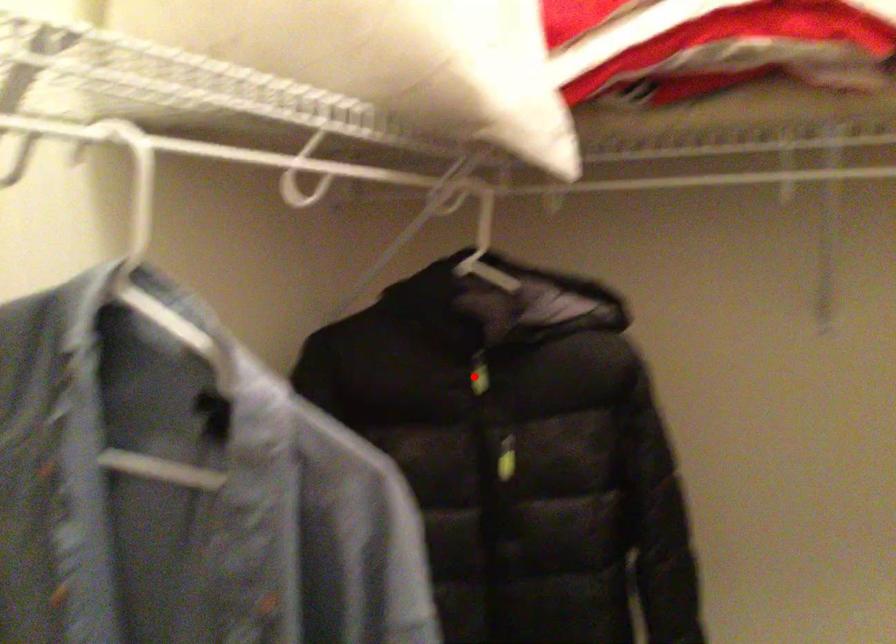
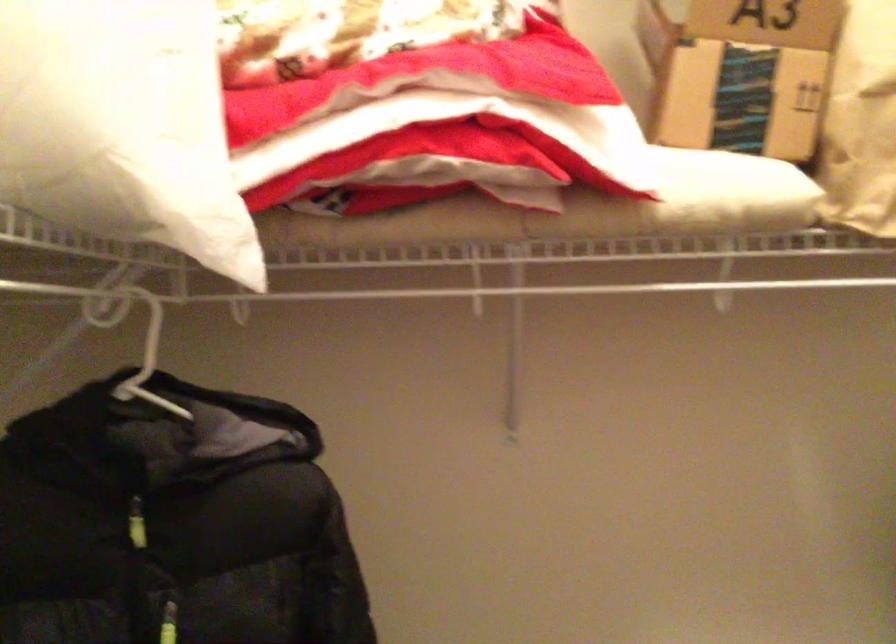
In the second image, find the point that corresponds to the highlighted location in the first image.

(136, 524)